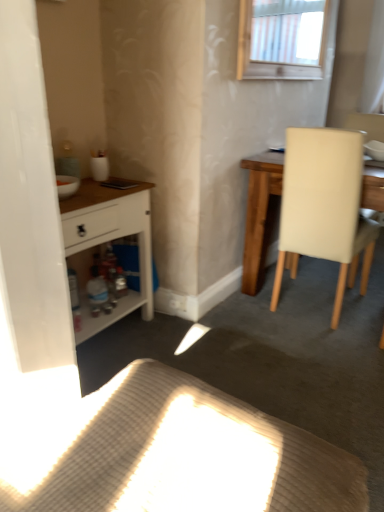
Question: Is beige leather chair at right taller or shorter than woven fabric cushion at lower center?

Choices:
 (A) tall
 (B) short

Answer: (A)

Question: Considering the positions of point (357, 231) and point (215, 428), is point (357, 231) closer or farther from the camera than point (215, 428)?

Choices:
 (A) closer
 (B) farther

Answer: (B)

Question: Which of these objects is positioned closest to the white matte cabinet at left?

Choices:
 (A) beige leather chair at right
 (B) white glossy bowl at upper right
 (C) transparent plastic screen door at left
 (D) woven fabric cushion at lower center

Answer: (C)

Question: Which of these objects is positioned closest to the beige leather chair at right?

Choices:
 (A) white matte cabinet at left
 (B) white glossy bowl at upper right
 (C) transparent plastic screen door at left
 (D) woven fabric cushion at lower center

Answer: (B)